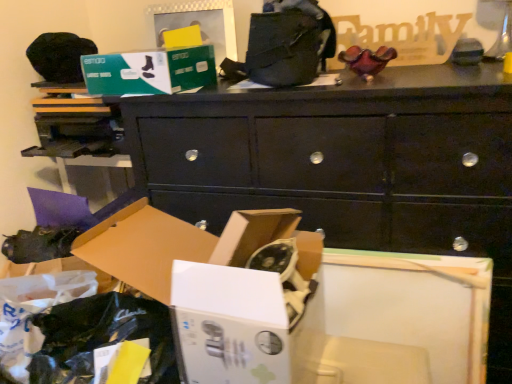
Question: In the image, is green cardboard box at upper center, placed as the first storage box when sorted from top to bottom, positioned in front of or behind black matte chest of drawers at center?

Choices:
 (A) behind
 (B) front

Answer: (A)

Question: Is green cardboard box at upper center, which ranks as the 2th storage box in bottom-to-top order, situated inside black matte chest of drawers at center or outside?

Choices:
 (A) outside
 (B) inside

Answer: (A)

Question: Which of these objects is positioned closest to the matte black shoe at lower left?

Choices:
 (A) white cardboard box at lower left, the second storage box viewed from the top
 (B) black matte chest of drawers at center
 (C) green cardboard box at upper center, placed as the first storage box when sorted from top to bottom

Answer: (C)

Question: Based on their relative distances, which object is nearer to the white cardboard box at lower left, the second storage box viewed from the top?

Choices:
 (A) black matte chest of drawers at center
 (B) green cardboard box at upper center, which ranks as the 2th storage box in bottom-to-top order
 (C) matte black shoe at lower left

Answer: (A)